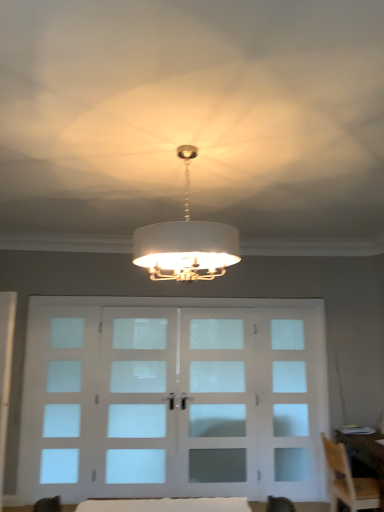
Question: Does white fabric lampshade at center have a lesser height compared to frosted glass window at left?

Choices:
 (A) yes
 (B) no

Answer: (A)

Question: From a real-world perspective, is white fabric lampshade at center positioned over frosted glass window at left based on gravity?

Choices:
 (A) yes
 (B) no

Answer: (A)

Question: Does white fabric lampshade at center have a smaller size compared to frosted glass window at left?

Choices:
 (A) no
 (B) yes

Answer: (A)

Question: Are white fabric lampshade at center and frosted glass window at left located far from each other?

Choices:
 (A) yes
 (B) no

Answer: (A)

Question: Considering the relative sizes of white fabric lampshade at center and frosted glass window at left in the image provided, is white fabric lampshade at center thinner than frosted glass window at left?

Choices:
 (A) no
 (B) yes

Answer: (A)

Question: From the image's perspective, is white fabric lampshade at center positioned above or below frosted glass window at left?

Choices:
 (A) below
 (B) above

Answer: (B)

Question: Relative to frosted glass window at left, is white fabric lampshade at center in front or behind?

Choices:
 (A) behind
 (B) front

Answer: (B)

Question: Considering the positions of point (173, 252) and point (57, 338), is point (173, 252) closer or farther from the camera than point (57, 338)?

Choices:
 (A) closer
 (B) farther

Answer: (A)

Question: Choose the correct answer: Is white fabric lampshade at center inside frosted glass window at left or outside it?

Choices:
 (A) outside
 (B) inside

Answer: (A)

Question: From the image's perspective, relative to white fabric table at lower center, is wooden chair at lower right above or below?

Choices:
 (A) above
 (B) below

Answer: (B)

Question: In terms of width, does wooden chair at lower right look wider or thinner when compared to white fabric table at lower center?

Choices:
 (A) thin
 (B) wide

Answer: (B)

Question: Relative to white fabric table at lower center, is wooden chair at lower right in front or behind?

Choices:
 (A) front
 (B) behind

Answer: (B)

Question: Considering the relative positions of wooden chair at lower right and white fabric table at lower center in the image provided, is wooden chair at lower right to the left or to the right of white fabric table at lower center?

Choices:
 (A) left
 (B) right

Answer: (B)

Question: Is clear glass door at center, acting as the 2th screen door starting from the right, wider or thinner than white fabric table at lower center?

Choices:
 (A) thin
 (B) wide

Answer: (A)

Question: In the image, is clear glass door at center, acting as the 2th screen door starting from the right, on the left side or the right side of white fabric table at lower center?

Choices:
 (A) right
 (B) left

Answer: (B)